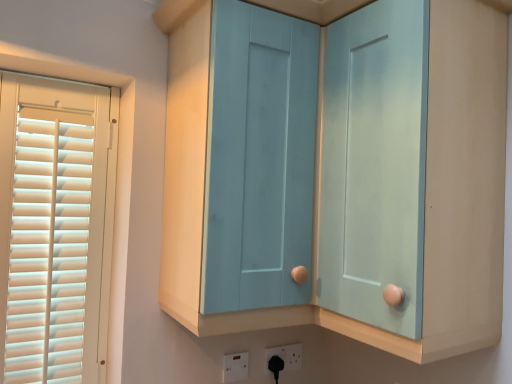
Question: Is white plastic socket at lower center, acting as the 1th electric outlet starting from the back, to the left of matte blue cabinet at center from the viewer's perspective?

Choices:
 (A) yes
 (B) no

Answer: (B)

Question: Would you say white plastic socket at lower center, acting as the 1th electric outlet starting from the back, contains matte blue cabinet at center?

Choices:
 (A) no
 (B) yes

Answer: (A)

Question: Are white plastic socket at lower center, acting as the 1th electric outlet starting from the back, and matte blue cabinet at center making contact?

Choices:
 (A) yes
 (B) no

Answer: (B)

Question: From a real-world perspective, does white plastic socket at lower center, positioned as the 2th electric outlet in front-to-back order, sit lower than matte blue cabinet at center?

Choices:
 (A) yes
 (B) no

Answer: (A)

Question: Does white plastic socket at lower center, the 2th electric outlet from the left, appear on the right side of matte blue cabinet at center?

Choices:
 (A) yes
 (B) no

Answer: (A)

Question: Is white plastic socket at lower center, acting as the 1th electric outlet starting from the back, not within matte blue cabinet at center?

Choices:
 (A) yes
 (B) no

Answer: (A)

Question: From a real-world perspective, is matte blue cabinet at center on white plastic electric outlet at lower center, acting as the first electric outlet starting from the front?

Choices:
 (A) no
 (B) yes

Answer: (B)

Question: Is matte blue cabinet at center wider than white plastic electric outlet at lower center, the 2th electric outlet positioned from the back?

Choices:
 (A) no
 (B) yes

Answer: (B)

Question: Is matte blue cabinet at center facing away from white plastic electric outlet at lower center, the 2th electric outlet positioned from the back?

Choices:
 (A) yes
 (B) no

Answer: (B)

Question: Considering the relative sizes of matte blue cabinet at center and white plastic electric outlet at lower center, arranged as the 2th electric outlet when viewed from the right, in the image provided, is matte blue cabinet at center taller than white plastic electric outlet at lower center, arranged as the 2th electric outlet when viewed from the right,?

Choices:
 (A) no
 (B) yes

Answer: (B)

Question: Does matte blue cabinet at center appear on the left side of white plastic electric outlet at lower center, the 1th electric outlet when ordered from left to right?

Choices:
 (A) yes
 (B) no

Answer: (A)

Question: Is matte blue cabinet at center next to white plastic electric outlet at lower center, acting as the first electric outlet starting from the front?

Choices:
 (A) yes
 (B) no

Answer: (B)

Question: Is matte blue cabinet at center turned away from light blue wood cabinet at center?

Choices:
 (A) yes
 (B) no

Answer: (A)